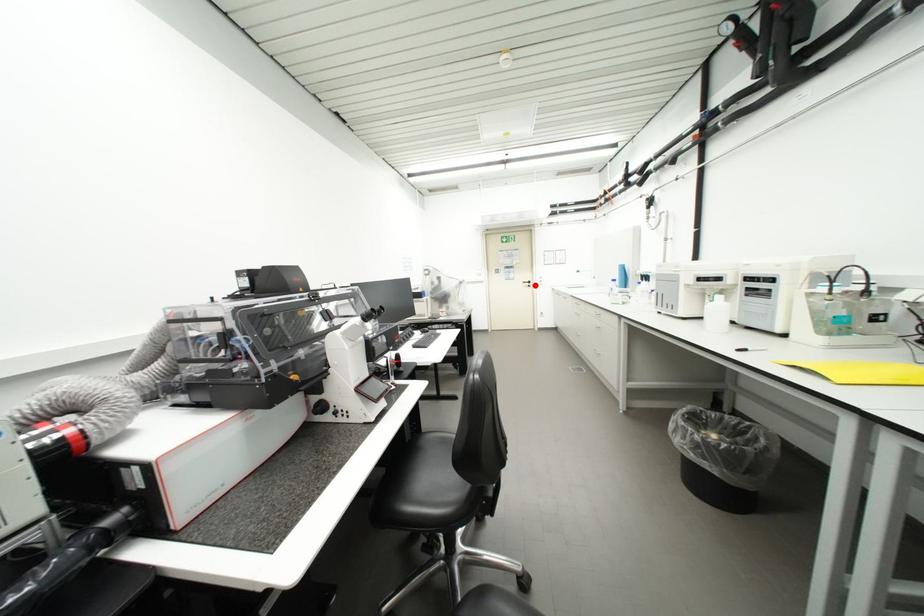
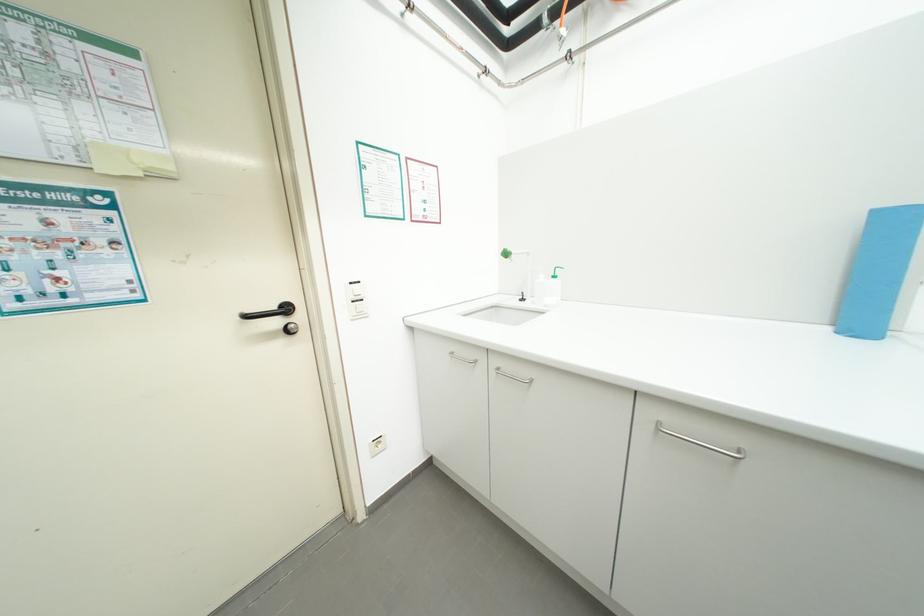
Find the pixel in the second image that matches the highlighted location in the first image.

(285, 323)